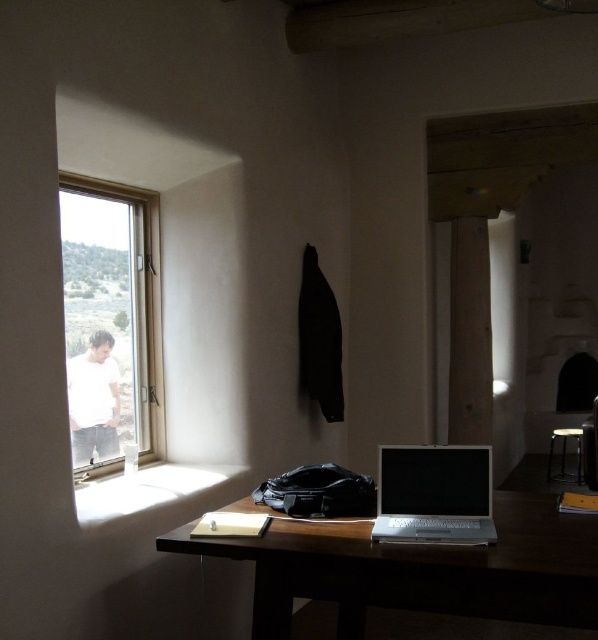
Question: Is clear glass window at left positioned at the back of silver metallic laptop at center?

Choices:
 (A) yes
 (B) no

Answer: (A)

Question: Estimate the real-world distances between objects in this image. Which object is farther from the wooden table at center?

Choices:
 (A) clear glass window at left
 (B) silver metallic laptop at center

Answer: (A)

Question: Does wooden table at center have a smaller size compared to clear glass window at left?

Choices:
 (A) yes
 (B) no

Answer: (B)

Question: Which object is the closest to the clear glass window at left?

Choices:
 (A) silver metallic laptop at center
 (B) wooden table at center

Answer: (B)

Question: Estimate the real-world distances between objects in this image. Which object is closer to the clear glass window at left?

Choices:
 (A) wooden table at center
 (B) silver metallic laptop at center

Answer: (A)

Question: Can you confirm if clear glass window at left is bigger than silver metallic laptop at center?

Choices:
 (A) no
 (B) yes

Answer: (B)